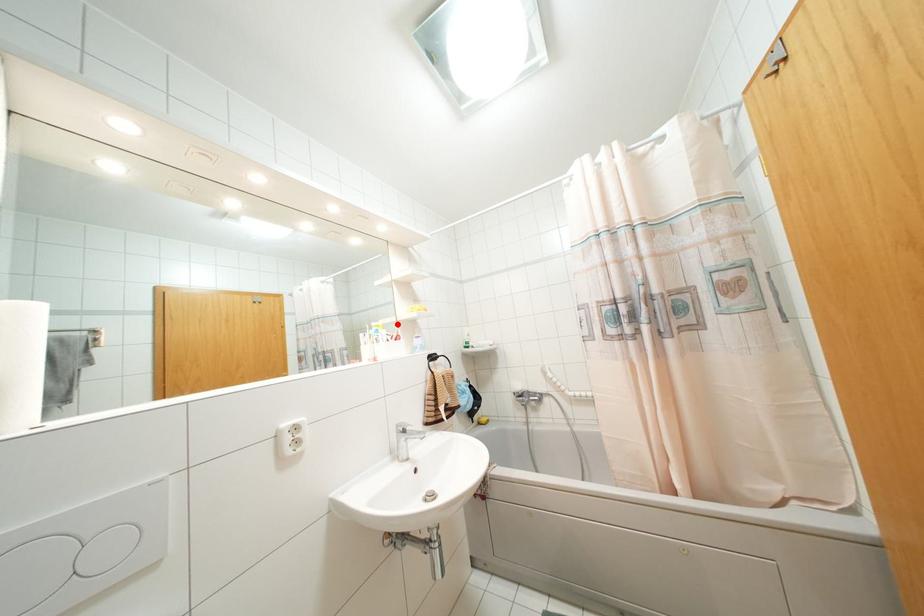
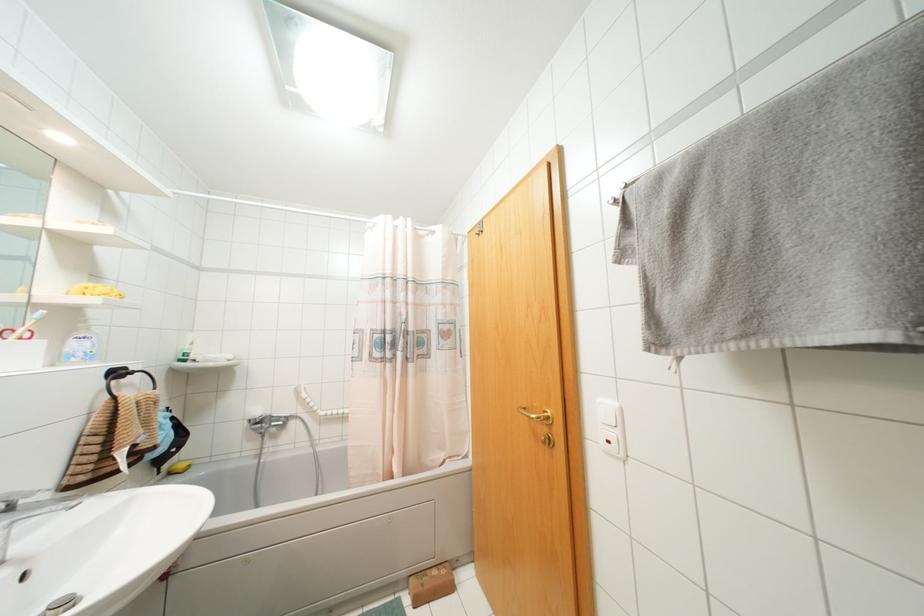
The point at the highlighted location is marked in the first image. Where is the corresponding point in the second image?

(42, 310)